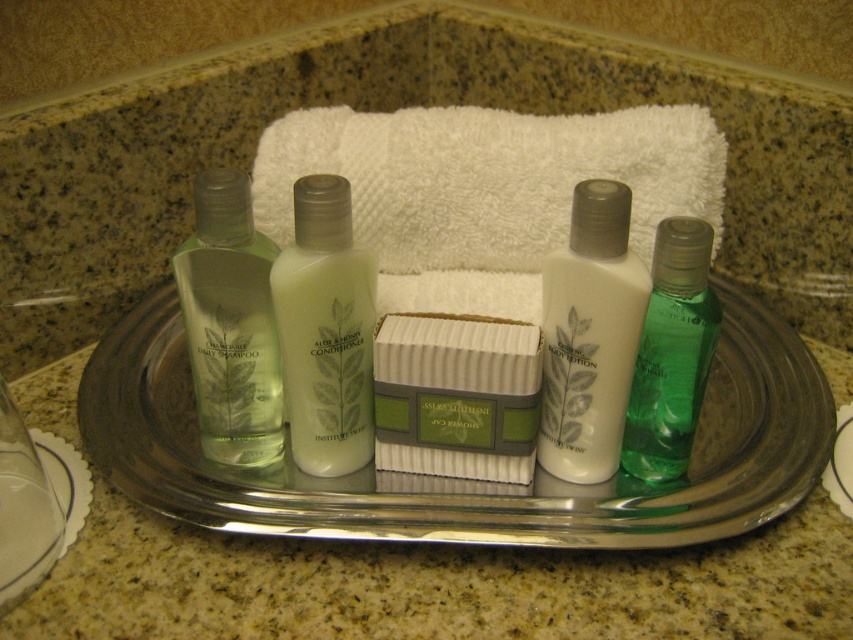
Does green matte daily shampoo at left appear on the right side of green translucent lotion at right?

Incorrect, green matte daily shampoo at left is not on the right side of green translucent lotion at right.

Between green matte daily shampoo at left and green translucent lotion at right, which one appears on the left side from the viewer's perspective?

From the viewer's perspective, green matte daily shampoo at left appears more on the left side.

Is point (213, 202) less distant than point (717, 317)?

Yes.

Where is `green matte daily shampoo at left`? green matte daily shampoo at left is located at coordinates click(230, 323).

Between clear plastic tray at center and white striped soap at center, which one appears on the right side from the viewer's perspective?

From the viewer's perspective, clear plastic tray at center appears more on the right side.

Which is more to the left, clear plastic tray at center or white striped soap at center?

white striped soap at center

Is point (368, 504) less distant than point (466, 456)?

Yes, it is in front of point (466, 456).

At what (x,y) coordinates should I click in order to perform the action: click on clear plastic tray at center. Please return your answer as a coordinate pair (x, y). The width and height of the screenshot is (853, 640). Looking at the image, I should click on (463, 480).

Is the position of white fluffy hand towel at center less distant than that of white striped soap at center?

No, it is behind white striped soap at center.

Can you confirm if white fluffy hand towel at center is positioned above white striped soap at center?

Indeed, white fluffy hand towel at center is positioned over white striped soap at center.

Who is more forward, (642, 234) or (476, 458)?

Point (476, 458)

Locate an element on the screen. white fluffy hand towel at center is located at coordinates pos(488,177).